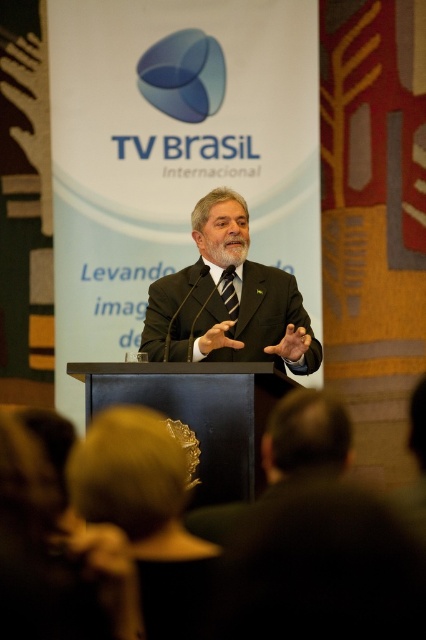
Question: Estimate the real-world distances between objects in this image. Which object is farther from the silky yellow hat at lower center?

Choices:
 (A) black striped tie at center
 (B) matte black suit at center
 (C) gray matte beard at center

Answer: (C)

Question: Does matte black suit at center have a lesser width compared to black striped tie at center?

Choices:
 (A) yes
 (B) no

Answer: (B)

Question: Where is blurred hair at lower left located in relation to gray matte beard at center in the image?

Choices:
 (A) above
 (B) below

Answer: (B)

Question: Which point appears farthest from the camera in this image?

Choices:
 (A) (264, 352)
 (B) (224, 225)
 (C) (158, 592)
 (D) (227, 312)

Answer: (B)

Question: Which point is closer to the camera?

Choices:
 (A) (201, 232)
 (B) (181, 476)

Answer: (B)

Question: Can you confirm if matte black suit at center is positioned below blurred hair at lower left?

Choices:
 (A) yes
 (B) no

Answer: (B)